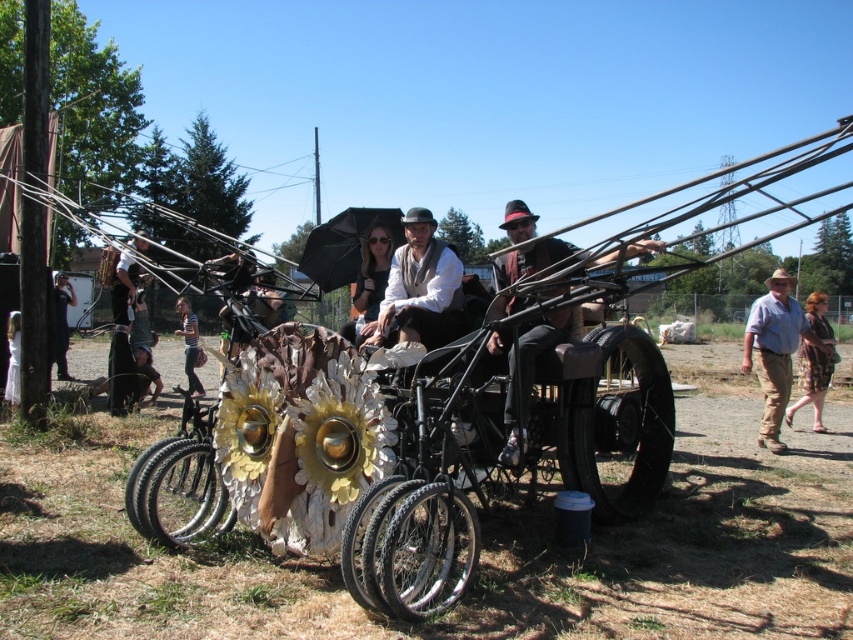
Is matte black bicycle at center thinner than matte black umbrella at center?

In fact, matte black bicycle at center might be wider than matte black umbrella at center.

The width and height of the screenshot is (853, 640). Describe the element at coordinates (531, 372) in the screenshot. I see `matte black bicycle at center` at that location.

Find the location of a particular element. This screenshot has width=853, height=640. matte black bicycle at center is located at coordinates (531, 372).

Between matte white hat at center and black suit at left, which one appears on the left side from the viewer's perspective?

Positioned to the left is black suit at left.

Does point (430, 230) come in front of point (57, 275)?

That is True.

The height and width of the screenshot is (640, 853). Describe the element at coordinates (422, 288) in the screenshot. I see `matte white hat at center` at that location.

In order to click on matte white hat at center in this screenshot , I will do `click(422, 288)`.

Between brown/canvas pants at right and black suit at left, which one has more height?

black suit at left is taller.

I want to click on brown/canvas pants at right, so click(x=775, y=349).